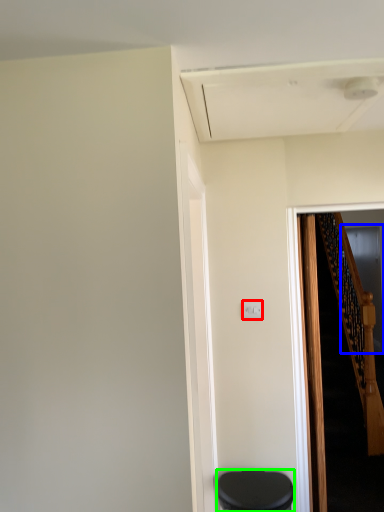
Question: Considering the real-world distances, which object is closest to electric outlet (highlighted by a red box)? glass door (highlighted by a blue box) or furniture (highlighted by a green box).

Choices:
 (A) glass door
 (B) furniture

Answer: (B)